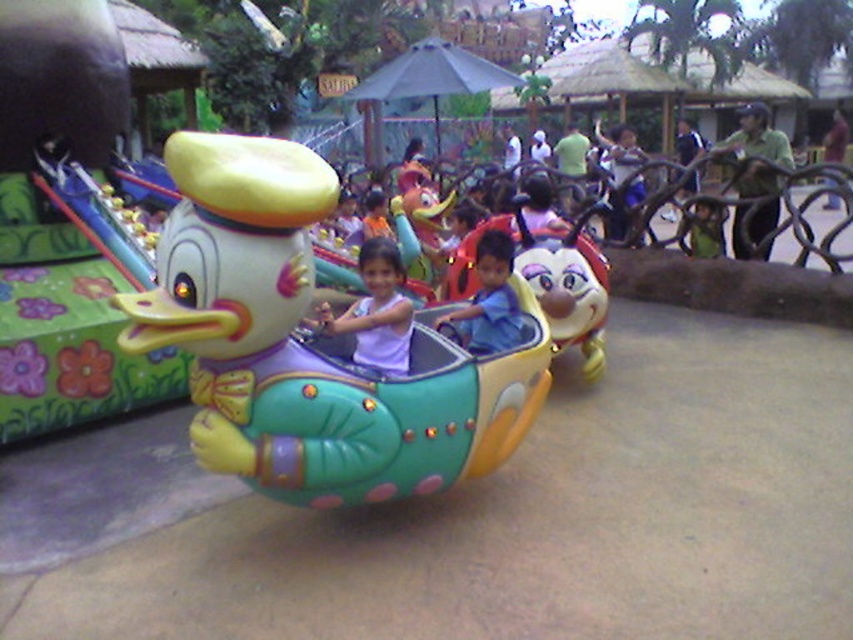
You are a photographer standing at the entrance of the amusement area. You want to take a photo of the glossy plastic duck at center and the matte purple shirt at center such that the duck is on the left side of the shirt in the frame. Is the current arrangement suitable for this requirement?

Yes, the glossy plastic duck at center is already positioned to the left of the matte purple shirt at center, so the current arrangement is suitable for the photo requirement.

What object is located at the coordinates point [309,344] in the image?

The glossy plastic duck at center is located at point [309,344].